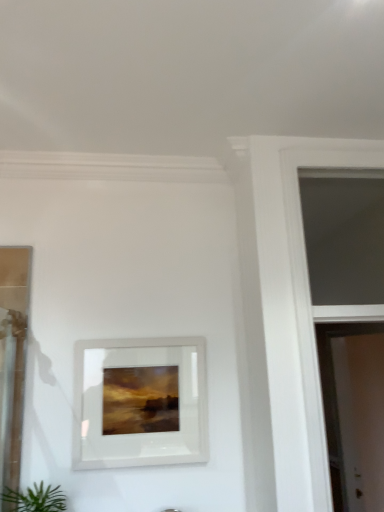
Question: Does transparent glass window at upper right have a larger size compared to white glossy screen door at right?

Choices:
 (A) no
 (B) yes

Answer: (A)

Question: Does transparent glass window at upper right appear on the left side of white glossy screen door at right?

Choices:
 (A) no
 (B) yes

Answer: (B)

Question: Is transparent glass window at upper right further to the viewer compared to white glossy screen door at right?

Choices:
 (A) no
 (B) yes

Answer: (A)

Question: Is transparent glass window at upper right not near white glossy screen door at right?

Choices:
 (A) yes
 (B) no

Answer: (B)

Question: Is transparent glass window at upper right looking in the opposite direction of white glossy screen door at right?

Choices:
 (A) yes
 (B) no

Answer: (B)

Question: Does transparent glass window at upper right have a lesser width compared to white glossy screen door at right?

Choices:
 (A) no
 (B) yes

Answer: (A)

Question: Does white glossy picture frame at center have a smaller size compared to green leafy plant at lower left?

Choices:
 (A) no
 (B) yes

Answer: (B)

Question: From the image's perspective, is white glossy picture frame at center beneath green leafy plant at lower left?

Choices:
 (A) no
 (B) yes

Answer: (A)

Question: Is white glossy picture frame at center closer to the viewer compared to green leafy plant at lower left?

Choices:
 (A) yes
 (B) no

Answer: (B)

Question: From a real-world perspective, is white glossy picture frame at center located higher than green leafy plant at lower left?

Choices:
 (A) yes
 (B) no

Answer: (A)

Question: From a real-world perspective, is white glossy picture frame at center physically below green leafy plant at lower left?

Choices:
 (A) yes
 (B) no

Answer: (B)

Question: Does white glossy picture frame at center turn towards green leafy plant at lower left?

Choices:
 (A) yes
 (B) no

Answer: (B)

Question: Would you say green leafy plant at lower left is outside white glossy picture frame at center?

Choices:
 (A) no
 (B) yes

Answer: (B)